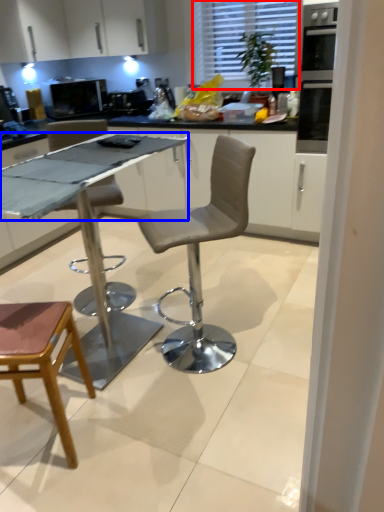
Question: Which object appears closest to the camera in this image, window (highlighted by a red box) or counter top (highlighted by a blue box)?

Choices:
 (A) window
 (B) counter top

Answer: (B)